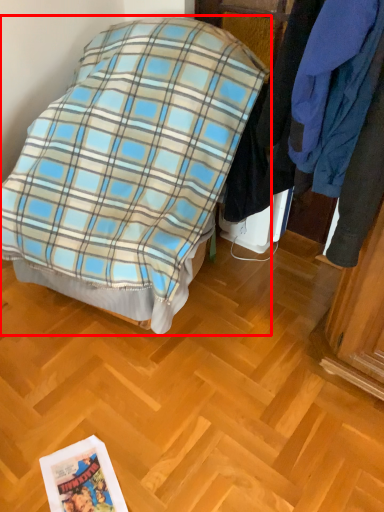
Question: From the image's perspective, where is bed (annotated by the red box) located relative to closet?

Choices:
 (A) above
 (B) below

Answer: (B)